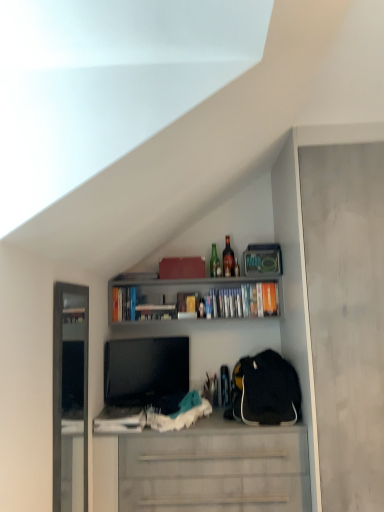
In order to click on black glossy tv at center in this screenshot , I will do `click(146, 372)`.

What do you see at coordinates (146, 372) in the screenshot? This screenshot has height=512, width=384. I see `black glossy tv at center` at bounding box center [146, 372].

What do you see at coordinates (215, 468) in the screenshot? The image size is (384, 512). I see `white matte cabinet at center` at bounding box center [215, 468].

The image size is (384, 512). What do you see at coordinates (265, 391) in the screenshot? I see `black fabric backpack at right` at bounding box center [265, 391].

The width and height of the screenshot is (384, 512). I want to click on translucent glass bottle at upper center, the second bottle in the left-to-right sequence, so click(x=228, y=257).

The image size is (384, 512). In order to click on hardcover books at upper center, placed as the 1th book when sorted from right to left in this screenshot , I will do `click(243, 300)`.

The height and width of the screenshot is (512, 384). I want to click on matte cardboard book at upper center, the 2th book positioned from the left, so click(x=186, y=304).

From the image's perspective, which is above, hardcover books at upper center, arranged as the third book when viewed from the left, or matte gray cabinet at right?

hardcover books at upper center, arranged as the third book when viewed from the left, appears higher in the image.

From a real-world perspective, who is located lower, hardcover books at upper center, placed as the 1th book when sorted from right to left, or matte gray cabinet at right?

matte gray cabinet at right, from a real-world perspective.

Can you tell me how much hardcover books at upper center, arranged as the third book when viewed from the left, and matte gray cabinet at right differ in facing direction?

The facing directions of hardcover books at upper center, arranged as the third book when viewed from the left, and matte gray cabinet at right are 0.754 degrees apart.

Can you tell me how much matte cardboard book at upper center, which appears as the second book when viewed from the right, and matte gray cabinet at right differ in facing direction?

The angle between the facing direction of matte cardboard book at upper center, which appears as the second book when viewed from the right, and the facing direction of matte gray cabinet at right is 0.701 degrees.

Does matte cardboard book at upper center, which appears as the second book when viewed from the right, lie in front of matte gray cabinet at right?

No, matte cardboard book at upper center, which appears as the second book when viewed from the right, is behind matte gray cabinet at right.

From the matte gray cabinet at right, count 3rd books backward and point to it. Please provide its 2D coordinates.

[(186, 304)]

Is matte cardboard book at upper center, which appears as the second book when viewed from the right, to the left of matte gray cabinet at right from the viewer's perspective?

Yes, matte cardboard book at upper center, which appears as the second book when viewed from the right, is to the left of matte gray cabinet at right.

Is black fabric backpack at right shorter than green glass bottle at upper center, which appears as the first bottle when viewed from the left?

No.

Is black fabric backpack at right located outside green glass bottle at upper center, which appears as the first bottle when viewed from the left?

Indeed, black fabric backpack at right is completely outside green glass bottle at upper center, which appears as the first bottle when viewed from the left.

Does black fabric backpack at right appear on the left side of green glass bottle at upper center, acting as the second bottle starting from the right?

No.

Between point (234, 412) and point (212, 252), which one is positioned behind?

Positioned behind is point (212, 252).

Between black glossy tv at center and hardcover books at upper center, arranged as the third book when viewed from the left, which one appears on the left side from the viewer's perspective?

black glossy tv at center is more to the left.

Considering the points (119, 394) and (244, 287), which point is behind, point (119, 394) or point (244, 287)?

Positioned behind is point (244, 287).

How much distance is there between black glossy tv at center and hardcover books at upper center, placed as the 1th book when sorted from right to left?

black glossy tv at center is 12.09 inches away from hardcover books at upper center, placed as the 1th book when sorted from right to left.

Considering the relative sizes of black glossy tv at center and hardcover books at upper center, placed as the 1th book when sorted from right to left, in the image provided, is black glossy tv at center thinner than hardcover books at upper center, placed as the 1th book when sorted from right to left,?

Correct, the width of black glossy tv at center is less than that of hardcover books at upper center, placed as the 1th book when sorted from right to left.

Where is `the 1st book in front when counting from the matte cardboard book at upper center, the 2th book positioned from the left`? the 1st book in front when counting from the matte cardboard book at upper center, the 2th book positioned from the left is located at coordinates (123, 303).

Consider the image. Is there a large distance between hardcover books at upper center, the third book positioned from the right, and matte cardboard book at upper center, the 2th book positioned from the left?

No, hardcover books at upper center, the third book positioned from the right, is in close proximity to matte cardboard book at upper center, the 2th book positioned from the left.

Looking at their sizes, would you say hardcover books at upper center, which appears as the 1th book when viewed from the left, is wider or thinner than matte cardboard book at upper center, the 2th book positioned from the left?

Clearly, hardcover books at upper center, which appears as the 1th book when viewed from the left, has less width compared to matte cardboard book at upper center, the 2th book positioned from the left.

How many degrees apart are the facing directions of black glossy tv at center and green glass bottle at upper center, acting as the second bottle starting from the right?

The angular difference between black glossy tv at center and green glass bottle at upper center, acting as the second bottle starting from the right, is 28.5 degrees.

Identify the location of television below the green glass bottle at upper center, which appears as the first bottle when viewed from the left (from the image's perspective). (146, 372).

Does point (122, 383) come closer to viewer compared to point (212, 246)?

Yes.

From the image's perspective, is black glossy tv at center on green glass bottle at upper center, which appears as the first bottle when viewed from the left?

No, from the image's perspective, black glossy tv at center is not over green glass bottle at upper center, which appears as the first bottle when viewed from the left.

From a real-world perspective, is translucent glass bottle at upper center, the second bottle in the left-to-right sequence, positioned above or below hardcover books at upper center, the third book positioned from the right?

translucent glass bottle at upper center, the second bottle in the left-to-right sequence, is situated higher than hardcover books at upper center, the third book positioned from the right, in the real world.

Where is `the 3rd book counting from the left side of the translucent glass bottle at upper center, which is counted as the 1th bottle, starting from the right`? the 3rd book counting from the left side of the translucent glass bottle at upper center, which is counted as the 1th bottle, starting from the right is located at coordinates (123, 303).

Between translucent glass bottle at upper center, which is counted as the 1th bottle, starting from the right, and hardcover books at upper center, which appears as the 1th book when viewed from the left, which one has smaller size?

translucent glass bottle at upper center, which is counted as the 1th bottle, starting from the right.

Find the location of a particular element. The image size is (384, 512). cabinet below the hardcover books at upper center, placed as the 1th book when sorted from right to left (from the image's perspective) is located at coordinates (304, 256).

The height and width of the screenshot is (512, 384). I want to click on cabinet in front of the matte cardboard book at upper center, the 2th book positioned from the left, so click(304, 256).

From the image, which object appears to be farther from green glass bottle at upper center, acting as the second bottle starting from the right, hardcover books at upper center, arranged as the third book when viewed from the left, or hardcover books at upper center, which appears as the 1th book when viewed from the left?

Among the two, hardcover books at upper center, which appears as the 1th book when viewed from the left, is located further to green glass bottle at upper center, acting as the second bottle starting from the right.

Based on their spatial positions, is black glossy tv at center or white matte cabinet at center closer to hardcover books at upper center, which appears as the 1th book when viewed from the left?

black glossy tv at center.

Estimate the real-world distances between objects in this image. Which object is closer to hardcover books at upper center, arranged as the third book when viewed from the left, matte cardboard book at upper center, the 2th book positioned from the left, or green glass bottle at upper center, acting as the second bottle starting from the right?

matte cardboard book at upper center, the 2th book positioned from the left, is positioned closer to the anchor hardcover books at upper center, arranged as the third book when viewed from the left.

Estimate the real-world distances between objects in this image. Which object is further from green glass bottle at upper center, acting as the second bottle starting from the right, translucent glass bottle at upper center, the second bottle in the left-to-right sequence, or black glossy tv at center?

black glossy tv at center lies further to green glass bottle at upper center, acting as the second bottle starting from the right, than the other object.

Which object lies further to the anchor point matte cardboard book at upper center, the 2th book positioned from the left, translucent glass bottle at upper center, the second bottle in the left-to-right sequence, or hardcover books at upper center, which appears as the 1th book when viewed from the left?

hardcover books at upper center, which appears as the 1th book when viewed from the left, is further to matte cardboard book at upper center, the 2th book positioned from the left.

From the image, which object appears to be nearer to black glossy tv at center, matte gray cabinet at right or black fabric backpack at right?

Among the two, black fabric backpack at right is located nearer to black glossy tv at center.

Looking at the image, which one is located closer to matte gray cabinet at right, black fabric backpack at right or hardcover books at upper center, arranged as the third book when viewed from the left?

black fabric backpack at right is positioned closer to the anchor matte gray cabinet at right.

From the image, which object appears to be nearer to matte cardboard book at upper center, the 2th book positioned from the left, translucent glass bottle at upper center, the second bottle in the left-to-right sequence, or green glass bottle at upper center, which appears as the first bottle when viewed from the left?

Answer: green glass bottle at upper center, which appears as the first bottle when viewed from the left, lies closer to matte cardboard book at upper center, the 2th book positioned from the left, than the other object.

I want to click on cabinet between translucent glass bottle at upper center, the second bottle in the left-to-right sequence, and white matte cabinet at center, in the vertical direction, so click(304, 256).

I want to click on backpack between matte cardboard book at upper center, which appears as the second book when viewed from the right, and white matte cabinet at center from top to bottom, so click(265, 391).

This screenshot has width=384, height=512. What are the coordinates of `backpack located between black glossy tv at center and matte gray cabinet at right in the left-right direction` in the screenshot? It's located at point(265,391).

Where is `cabinet between green glass bottle at upper center, acting as the second bottle starting from the right, and white matte cabinet at center from top to bottom`? The width and height of the screenshot is (384, 512). cabinet between green glass bottle at upper center, acting as the second bottle starting from the right, and white matte cabinet at center from top to bottom is located at coordinates pyautogui.click(x=304, y=256).